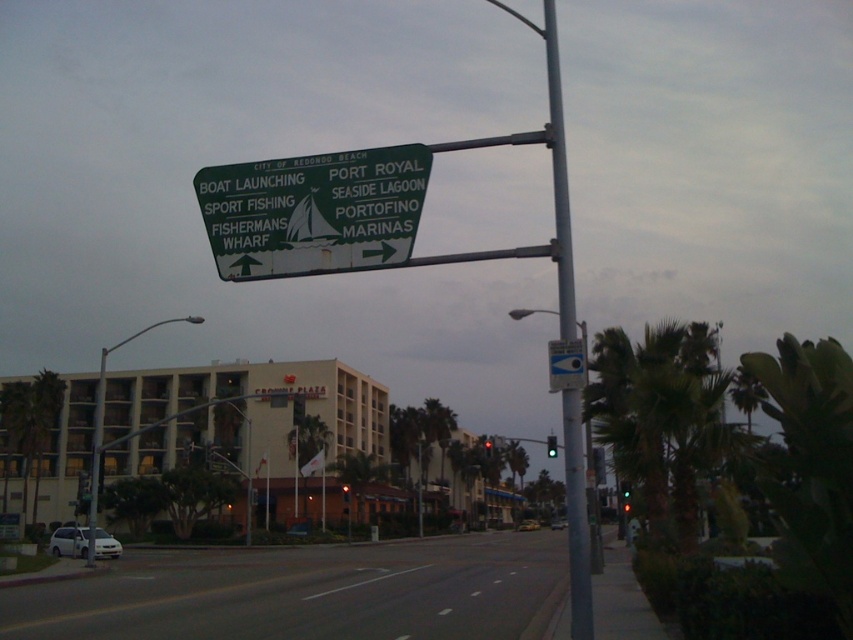
Based on the scene description, what object is located at the coordinates point (550, 445)?

The point (550, 445) indicates the green glass traffic light at upper center.

You are a pedestrian standing at the intersection near the green directional sign. You need to cross the street to reach the SEASIDE LAGOON, which is located to the right of the sign. There is a yellow metallic taxi cab at center and a white matte car at center. Which vehicle is narrower, and would it be easier to navigate around to reach the SEASIDE LAGOON?

The yellow metallic taxi cab at center has a lesser width compared to the white matte car at center, so it would be easier to navigate around the yellow metallic taxi cab at center to reach the SEASIDE LAGOON.